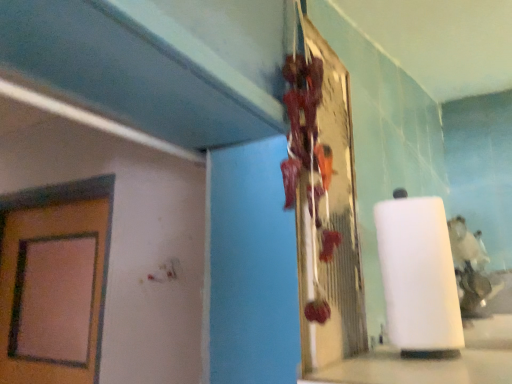
Question: Is white matte paper towel at center taller or shorter than metallic reflective board at center?

Choices:
 (A) tall
 (B) short

Answer: (B)

Question: From a real-world perspective, relative to metallic reflective board at center, is white matte paper towel at center vertically above or below?

Choices:
 (A) above
 (B) below

Answer: (B)

Question: In the image, is white matte paper towel at center positioned in front of or behind metallic reflective board at center?

Choices:
 (A) front
 (B) behind

Answer: (B)

Question: Considering the positions of metallic reflective board at center and white matte paper towel at center in the image, is metallic reflective board at center wider or thinner than white matte paper towel at center?

Choices:
 (A) wide
 (B) thin

Answer: (B)

Question: Would you say metallic reflective board at center is inside or outside white matte paper towel at center?

Choices:
 (A) outside
 (B) inside

Answer: (A)

Question: From a real-world perspective, relative to white matte paper towel at center, is metallic reflective board at center vertically above or below?

Choices:
 (A) below
 (B) above

Answer: (B)

Question: Based on their positions, is metallic reflective board at center located to the left or right of white matte paper towel at center?

Choices:
 (A) left
 (B) right

Answer: (A)